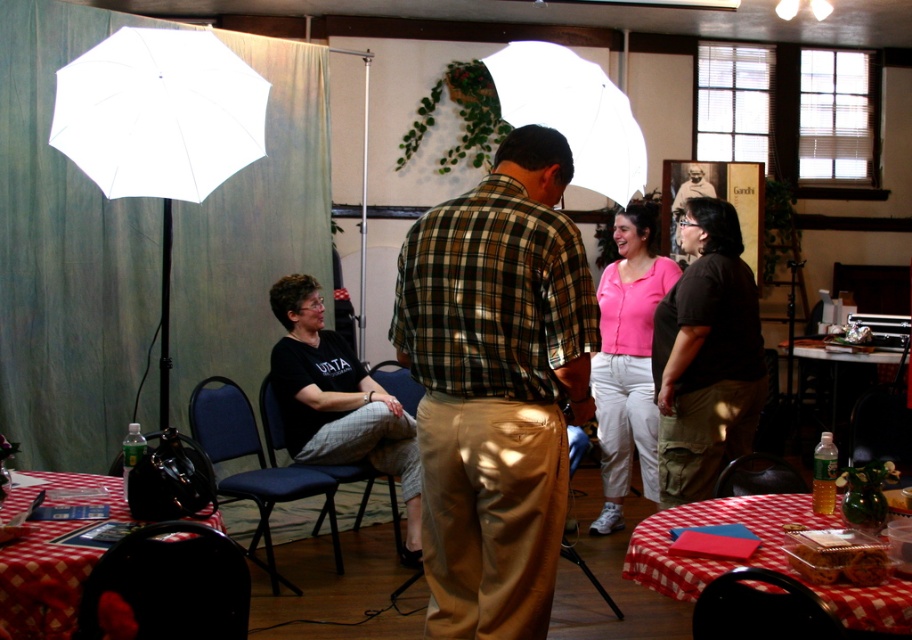
You are organizing a small indoor event and need to move a black plastic chair at lower right closer to the white matte umbrella at upper left. Which direction should you move the chair to place it next to the umbrella?

You should move the black plastic chair at lower right to the left to place it next to the white matte umbrella at upper left since the white matte umbrella at upper left is located to the left of the black plastic chair at lower right.

You are organizing a small event and need to decide where to place a new decoration. You have a green plaid shirt at center and a white matte umbrella at upper left in view. Which object is taller so that you can place the decoration accordingly?

The green plaid shirt at center is taller than the white matte umbrella at upper left, so you should place the decoration considering the height of the green plaid shirt at center.

You are standing in the room and want to take a closer look at the white matte umbrella at upper left. If you walk 2 meters towards it, will you be able to reach it?

The white matte umbrella at upper left is 3.13 meters away from the camera. If you walk 2 meters towards it, you will still be 1.13 meters away and cannot reach it.